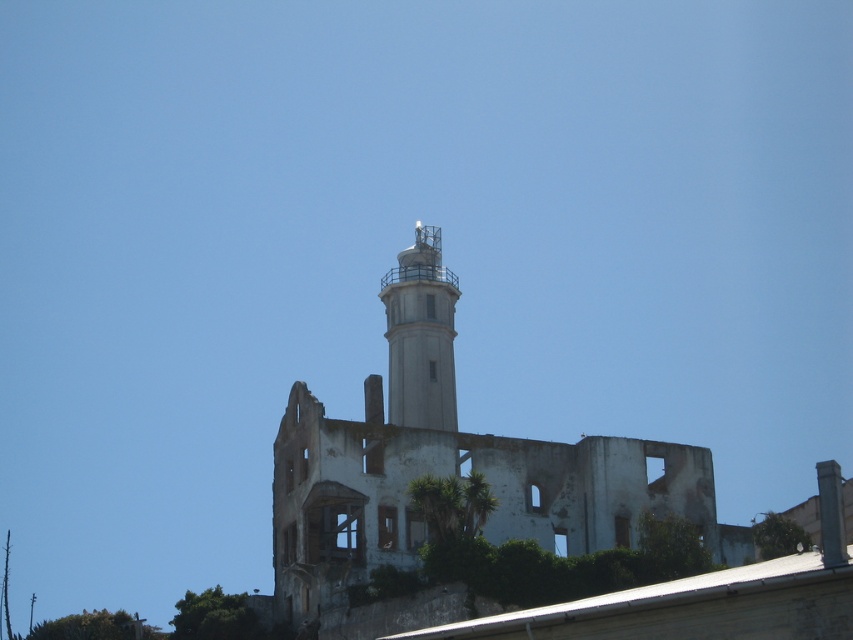
Can you confirm if white weathered concrete ruins at center is smaller than white concrete tower at center?

No, white weathered concrete ruins at center is not smaller than white concrete tower at center.

Is white weathered concrete ruins at center below white concrete tower at center?

Yes, white weathered concrete ruins at center is below white concrete tower at center.

Between point (299, 512) and point (399, 275), which one is positioned in front?

Point (299, 512) is more forward.

You are a GUI agent. You are given a task and a screenshot of the screen. Output one action in this format:
    pyautogui.click(x=<x>, y=<y>)
    Task: Click on the white weathered concrete ruins at center
    
    Given the screenshot: What is the action you would take?
    pyautogui.click(x=451, y=465)